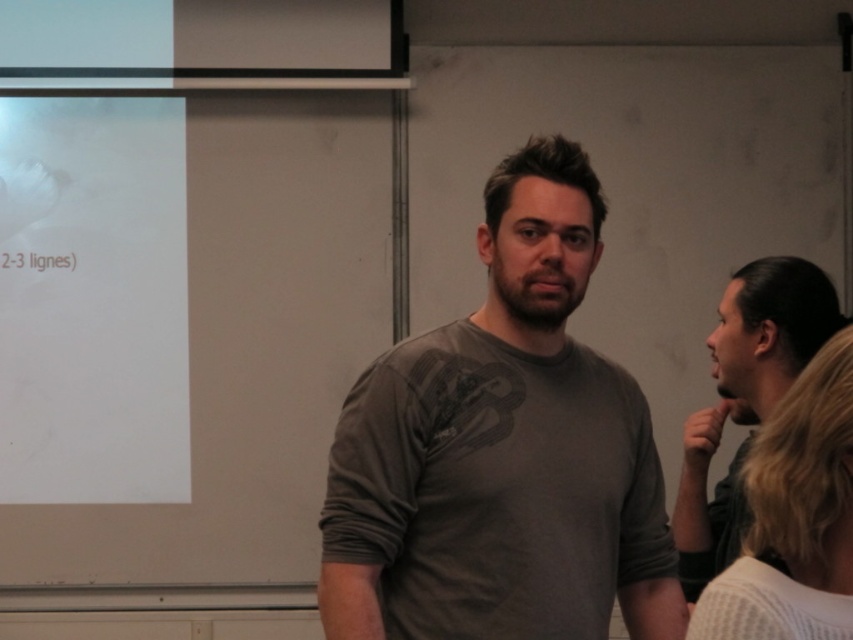
Question: Which is farther from the white knitted sweater at right?

Choices:
 (A) white paper at upper left
 (B) gray matte t-shirt at center

Answer: (A)

Question: Can you confirm if gray matte t-shirt at center is smaller than white knitted sweater at right?

Choices:
 (A) yes
 (B) no

Answer: (B)

Question: Is gray matte t-shirt at center thinner than white paper at upper left?

Choices:
 (A) yes
 (B) no

Answer: (A)

Question: Is white paper at upper left thinner than white knitted sweater at right?

Choices:
 (A) yes
 (B) no

Answer: (B)

Question: Among these objects, which one is farthest from the camera?

Choices:
 (A) white knitted sweater at right
 (B) gray matte t-shirt at center

Answer: (B)

Question: Among these points, which one is farthest from the camera?

Choices:
 (A) (697, 624)
 (B) (35, 100)
 (C) (456, 323)

Answer: (B)